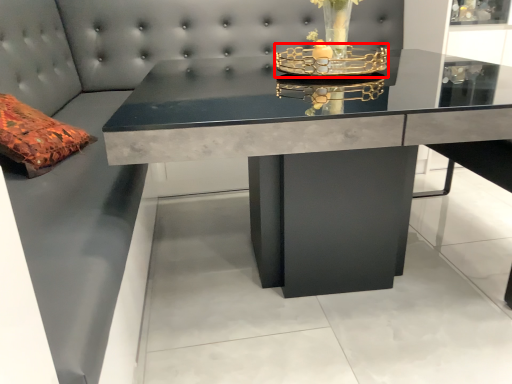
Question: From the image's perspective, what is the correct spatial relationship of candle holder (annotated by the red box) in relation to table?

Choices:
 (A) above
 (B) below

Answer: (A)